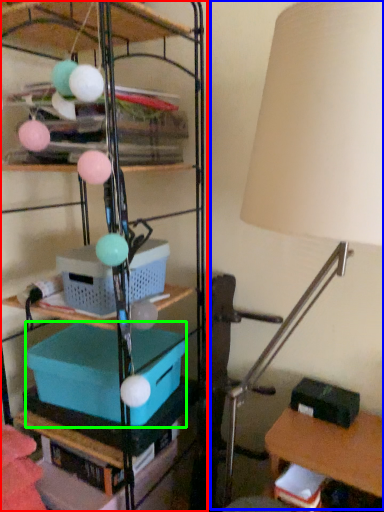
Question: Which object is the closest to the shelf (highlighted by a red box)? Choose among these: lamp (highlighted by a blue box) or storage box (highlighted by a green box).

Choices:
 (A) lamp
 (B) storage box

Answer: (B)